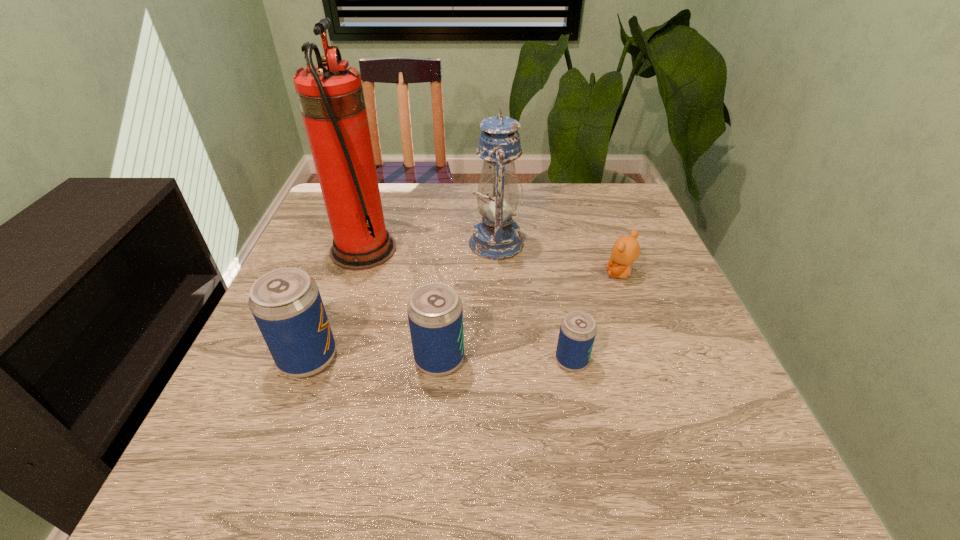
Identify the location of the leftmost beer can. The width and height of the screenshot is (960, 540). (286, 303).

This screenshot has width=960, height=540. In order to click on the second shortest beer can in this screenshot , I will do `click(435, 313)`.

At what (x,y) coordinates should I click in order to perform the action: click on the second beer can from right to left. Please return your answer as a coordinate pair (x, y). The height and width of the screenshot is (540, 960). Looking at the image, I should click on (435, 313).

Locate an element on the screen. the rightmost beer can is located at coordinates (577, 333).

Where is `the shortest beer can`? Image resolution: width=960 pixels, height=540 pixels. the shortest beer can is located at coordinates (577, 333).

The image size is (960, 540). In order to click on the fifth shortest object in this screenshot , I will do `click(496, 236)`.

In order to click on the third object from right to left in this screenshot , I will do `click(496, 236)`.

At what (x,y) coordinates should I click in order to perform the action: click on teddy bear. Please return your answer as a coordinate pair (x, y). Looking at the image, I should click on (626, 249).

I want to click on fire extinguisher, so [331, 99].

Identify the location of free space located on the left of the leftmost beer can. (254, 358).